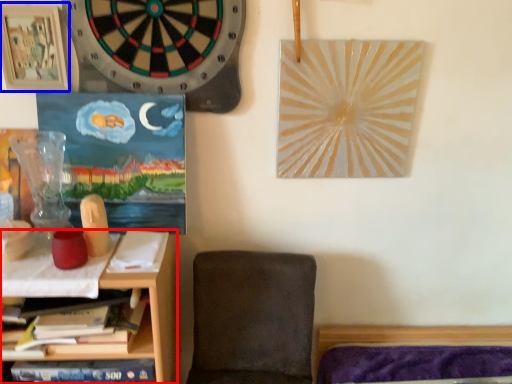
Question: Among these objects, which one is farthest to the camera, shelf (highlighted by a red box) or picture frame (highlighted by a blue box)?

Choices:
 (A) shelf
 (B) picture frame

Answer: (B)